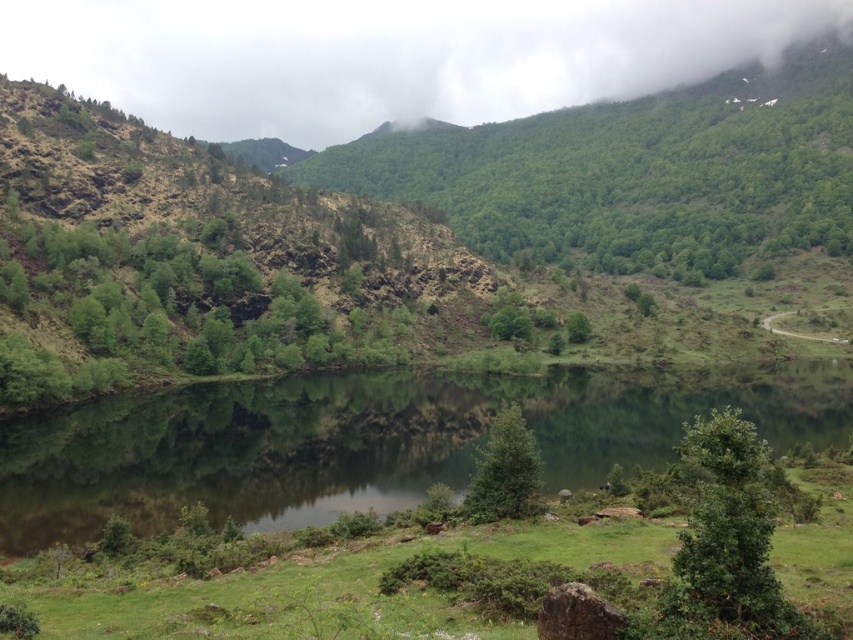
Question: Can you confirm if green reflective water at center is positioned to the right of green matte tree at center?

Choices:
 (A) no
 (B) yes

Answer: (B)

Question: Which point is farther to the camera?

Choices:
 (A) (357, 28)
 (B) (515, 458)
 (C) (724, 579)

Answer: (A)

Question: Based on their relative distances, which object is farther from the cloudy sky at upper center?

Choices:
 (A) green reflective water at center
 (B) green leafy tree at center

Answer: (B)

Question: Can you confirm if green reflective water at center is positioned to the right of green leafy tree at lower right?

Choices:
 (A) yes
 (B) no

Answer: (A)

Question: Is the position of green reflective water at center less distant than that of green leafy tree at center?

Choices:
 (A) yes
 (B) no

Answer: (A)

Question: Which object is positioned closest to the green leafy tree at lower right?

Choices:
 (A) green matte tree at center
 (B) cloudy sky at upper center
 (C) green reflective water at center
 (D) green leafy tree at center

Answer: (A)